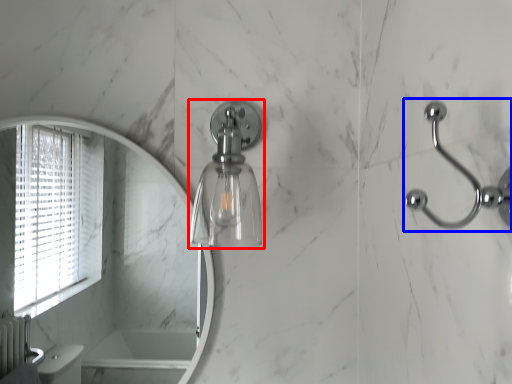
Question: Which point is closer to the camera, soap dispenser (highlighted by a red box) or door handle (highlighted by a blue box)?

Choices:
 (A) soap dispenser
 (B) door handle

Answer: (B)